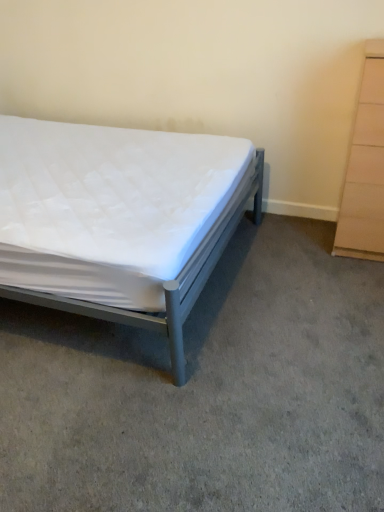
Where is `blank space to the left of beige wood chest of drawers at right`? blank space to the left of beige wood chest of drawers at right is located at coordinates (299, 242).